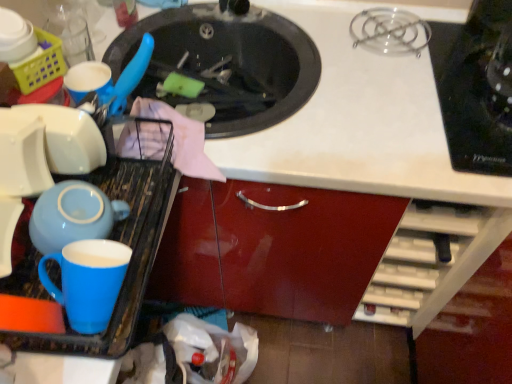
Question: Considering the relative sizes of blue glossy mug at left and plastic yellow basket at upper left in the image provided, is blue glossy mug at left smaller than plastic yellow basket at upper left?

Choices:
 (A) yes
 (B) no

Answer: (B)

Question: Is blue glossy mug at left to the right of plastic yellow basket at upper left from the viewer's perspective?

Choices:
 (A) no
 (B) yes

Answer: (B)

Question: Can you confirm if blue glossy mug at left is shorter than plastic yellow basket at upper left?

Choices:
 (A) yes
 (B) no

Answer: (A)

Question: Considering the relative sizes of blue glossy mug at left and plastic yellow basket at upper left in the image provided, is blue glossy mug at left thinner than plastic yellow basket at upper left?

Choices:
 (A) yes
 (B) no

Answer: (B)

Question: Is the position of blue glossy mug at left less distant than that of plastic yellow basket at upper left?

Choices:
 (A) yes
 (B) no

Answer: (A)

Question: Does point (137, 158) appear closer or farther from the camera than point (31, 79)?

Choices:
 (A) closer
 (B) farther

Answer: (B)

Question: Looking at the image, does blue glossy mug at left seem bigger or smaller compared to plastic yellow basket at upper left?

Choices:
 (A) small
 (B) big

Answer: (B)

Question: In the image, is blue glossy mug at left on the left side or the right side of plastic yellow basket at upper left?

Choices:
 (A) right
 (B) left

Answer: (A)

Question: From a real-world perspective, relative to plastic yellow basket at upper left, is blue glossy mug at left vertically above or below?

Choices:
 (A) below
 (B) above

Answer: (A)

Question: From a real-world perspective, is blue glossy mug at left above or below black glossy sink at upper center?

Choices:
 (A) below
 (B) above

Answer: (B)

Question: Looking at the image, does blue glossy mug at left seem bigger or smaller compared to black glossy sink at upper center?

Choices:
 (A) small
 (B) big

Answer: (A)

Question: Is blue glossy mug at left spatially inside black glossy sink at upper center, or outside of it?

Choices:
 (A) outside
 (B) inside

Answer: (A)

Question: Is blue glossy mug at left taller or shorter than black glossy sink at upper center?

Choices:
 (A) tall
 (B) short

Answer: (B)

Question: Considering their positions, is black glossy sink at upper center located in front of or behind plastic yellow basket at upper left?

Choices:
 (A) front
 (B) behind

Answer: (B)

Question: From the image's perspective, is black glossy sink at upper center located above or below plastic yellow basket at upper left?

Choices:
 (A) below
 (B) above

Answer: (B)